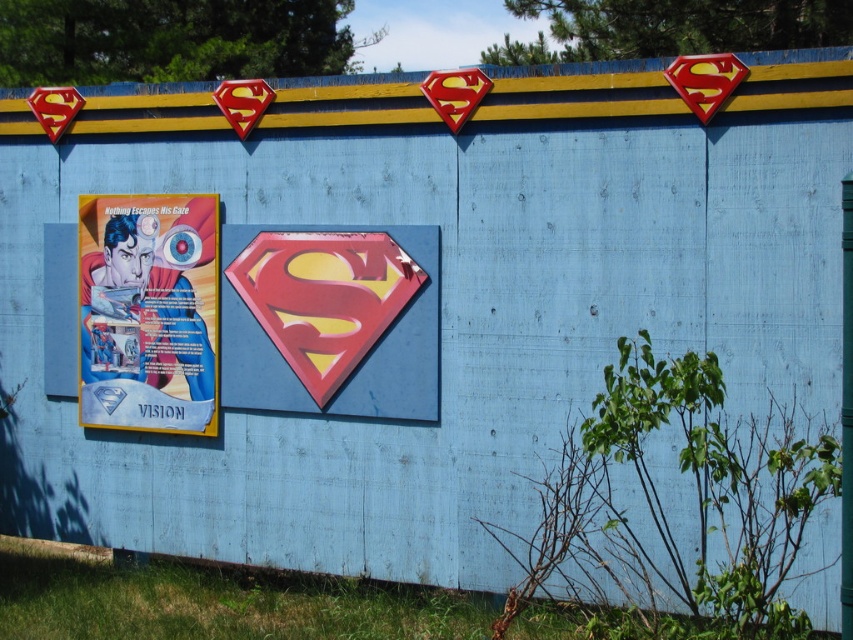
Question: Is metallic silver comic book at center above matte paper poster at left?

Choices:
 (A) no
 (B) yes

Answer: (A)

Question: Is metallic silver comic book at center below matte paper poster at left?

Choices:
 (A) no
 (B) yes

Answer: (B)

Question: Is metallic silver comic book at center further to the viewer compared to matte paper poster at left?

Choices:
 (A) no
 (B) yes

Answer: (A)

Question: Which point is farther to the camera?

Choices:
 (A) metallic silver comic book at center
 (B) matte paper poster at left

Answer: (B)

Question: Which point is closer to the camera?

Choices:
 (A) matte paper poster at left
 (B) metallic silver comic book at center

Answer: (B)